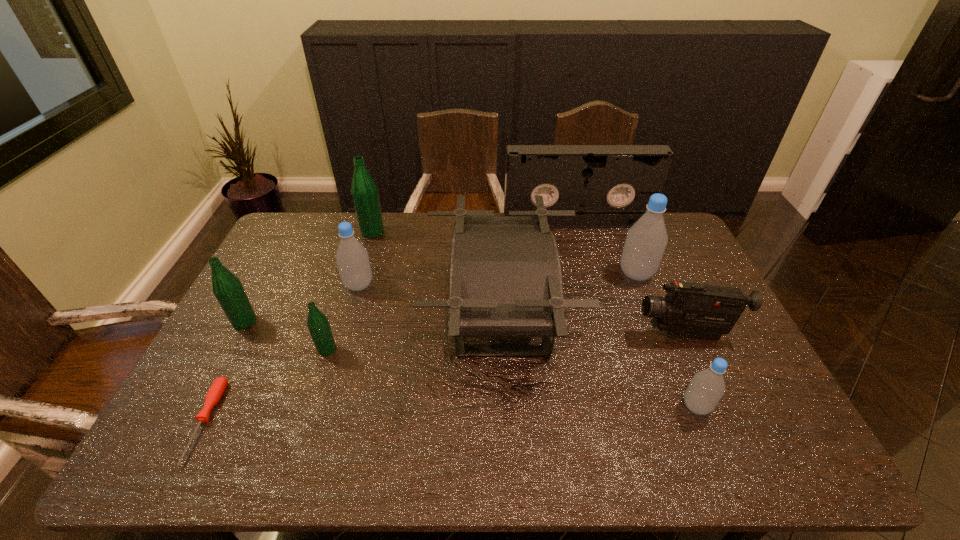
Where is `the nearest green bottle`? This screenshot has width=960, height=540. the nearest green bottle is located at coordinates (318, 324).

I want to click on the nearest gray bottle, so click(707, 387).

Image resolution: width=960 pixels, height=540 pixels. I want to click on the nearest bottle, so click(x=707, y=387).

Where is `screwdriver`? The height and width of the screenshot is (540, 960). screwdriver is located at coordinates (218, 387).

Locate an element on the screen. This screenshot has width=960, height=540. free space located on the side of the gray videotape with visible spindles is located at coordinates (587, 259).

Find the location of a particular element. free space located on the right of the farthest green bottle is located at coordinates (452, 232).

Where is `free region located on the front of the biggest gray bottle`? The width and height of the screenshot is (960, 540). free region located on the front of the biggest gray bottle is located at coordinates (676, 374).

Image resolution: width=960 pixels, height=540 pixels. Find the location of `vacant space located with a camera mounted on the underside of the drone`. vacant space located with a camera mounted on the underside of the drone is located at coordinates (385, 315).

The width and height of the screenshot is (960, 540). In order to click on free location located 0.120m with a camera mounted on the underside of the drone in this screenshot , I will do `click(389, 315)`.

Identify the location of vacant space located 0.070m with a camera mounted on the underside of the drone. This screenshot has width=960, height=540. tap(405, 315).